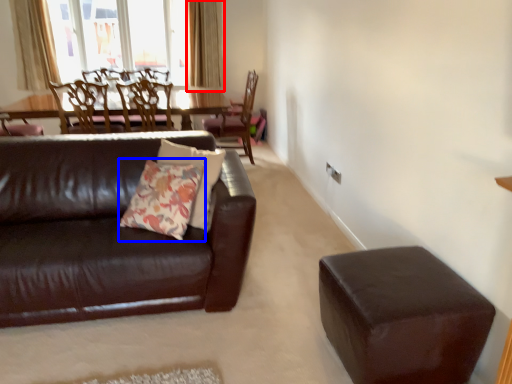
Question: Which point is further to the camera, curtain (highlighted by a red box) or throw pillow (highlighted by a blue box)?

Choices:
 (A) curtain
 (B) throw pillow

Answer: (A)